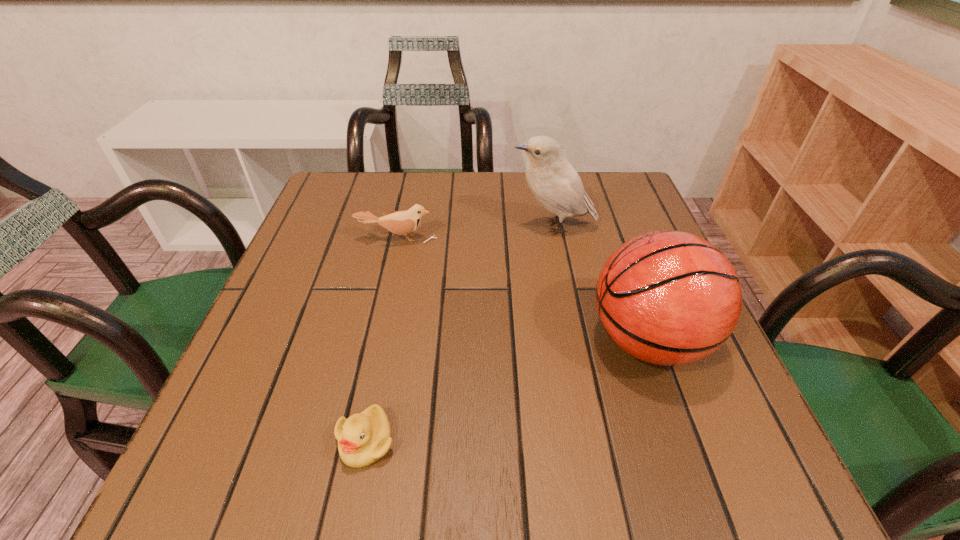
The image size is (960, 540). In order to click on vacant space positioned 0.150m on the side with spill of the third farthest object in this screenshot , I will do `click(503, 340)`.

Where is `vacant space located on the side with spill of the third farthest object`? This screenshot has height=540, width=960. vacant space located on the side with spill of the third farthest object is located at coordinates (464, 340).

This screenshot has width=960, height=540. Identify the location of blank space located 0.240m at the beak of the second shortest object. (377, 329).

This screenshot has height=540, width=960. In order to click on object present at the far edge in this screenshot , I will do `click(555, 183)`.

The height and width of the screenshot is (540, 960). I want to click on object located at the near edge, so click(363, 438).

Identify the location of object that is positioned at the left edge. (400, 222).

I want to click on bird at the right edge, so click(x=555, y=183).

Where is `basketball that is at the right edge`? The image size is (960, 540). basketball that is at the right edge is located at coordinates (666, 297).

Identify the location of object situated at the far right corner. The image size is (960, 540). (555, 183).

This screenshot has width=960, height=540. In the image, there is a desktop. In order to click on vacant space at the far edge in this screenshot , I will do `click(470, 183)`.